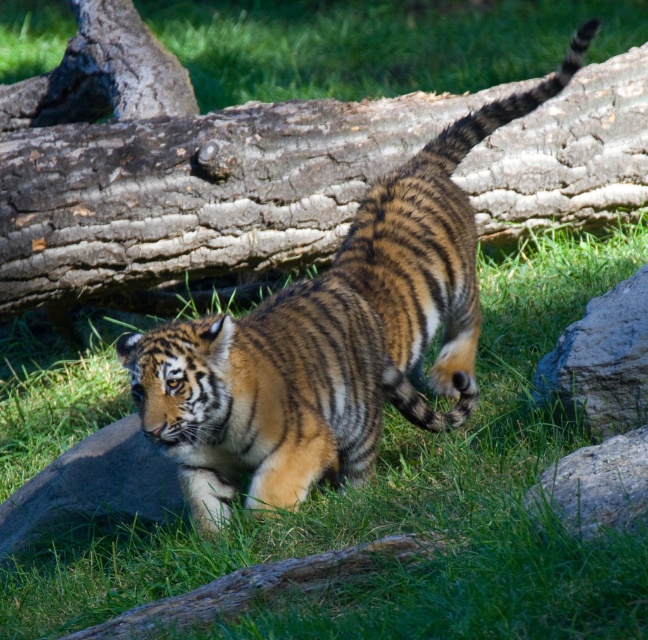
You are a zookeeper planning to place a new feeding station in the tiger enclosure. The tiger is currently walking near the brown rough bark log at center. To ensure the feeding station is visible from the log, where should you place it relative to the log?

The feeding station should be placed in a location visible from the brown rough bark log at center. Since the log is located at coordinates (189, 180), positioning the feeding station in an area that maintains a clear line of sight from these coordinates would be ideal.

Consider the image. You are a zookeeper who needs to place a new feeding tray for the tiger. The tray requires a stable surface that is wider than 30 cm. Based on the image, which object between the brown rough bark log at center and the gray rough rock at right would be more suitable for placing the feeding tray?

The brown rough bark log at center might be wider than gray rough rock at right, so it is more likely to provide a stable surface wider than 30 cm for the feeding tray.